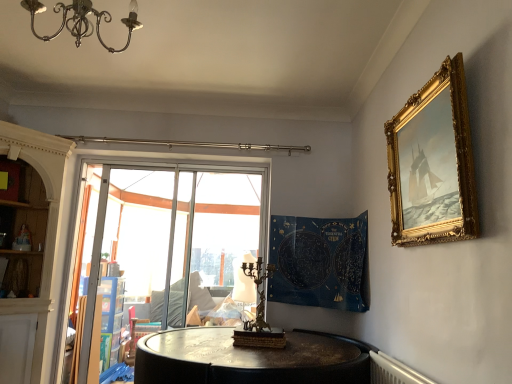
Question: From a real-world perspective, relative to blue fabric tapestry at center, is transparent glass window at center vertically above or below?

Choices:
 (A) below
 (B) above

Answer: (A)

Question: In terms of height, does transparent glass window at center look taller or shorter compared to blue fabric tapestry at center?

Choices:
 (A) tall
 (B) short

Answer: (A)

Question: Which object is positioned closest to the gold ornate frame at upper right?

Choices:
 (A) bronze/copper candle holder at center
 (B) transparent glass window at center
 (C) transparent plastic at center
 (D) blue fabric tapestry at center
 (E) metallic chandelier at upper left

Answer: (D)

Question: Estimate the real-world distances between objects in this image. Which object is farther from the gold ornate frame at upper right?

Choices:
 (A) transparent plastic at center
 (B) bronze/copper candle holder at center
 (C) transparent glass window at center
 (D) blue fabric tapestry at center
 (E) metallic chandelier at upper left

Answer: (A)